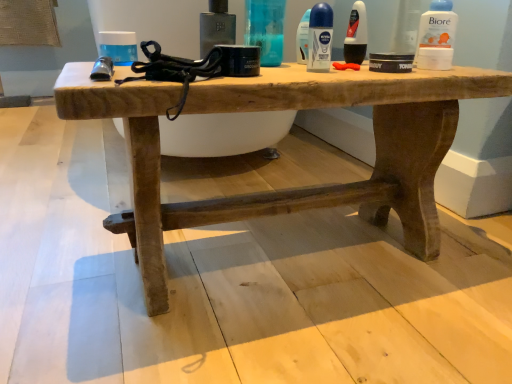
Question: From the image's perspective, is white plastic biore at upper right, which is counted as the second mouthwash, starting from the front, beneath matte black deodorant at center, the third toiletry viewed from the left?

Choices:
 (A) yes
 (B) no

Answer: (B)

Question: Is white plastic biore at upper right, which appears as the 3th mouthwash when viewed from the left, facing away from matte black deodorant at center, placed as the first toiletry when sorted from right to left?

Choices:
 (A) yes
 (B) no

Answer: (B)

Question: Considering the relative positions of white plastic biore at upper right, which appears as the 3th mouthwash when viewed from the left, and matte black deodorant at center, placed as the first toiletry when sorted from right to left, in the image provided, is white plastic biore at upper right, which appears as the 3th mouthwash when viewed from the left, behind matte black deodorant at center, placed as the first toiletry when sorted from right to left,?

Choices:
 (A) yes
 (B) no

Answer: (B)

Question: From a real-world perspective, is white plastic biore at upper right, which is the 2th mouthwash in back-to-front order, positioned over matte black deodorant at center, the third toiletry viewed from the left, based on gravity?

Choices:
 (A) no
 (B) yes

Answer: (B)

Question: Is matte black deodorant at center, placed as the first toiletry when sorted from right to left, located within white plastic biore at upper right, which is counted as the second mouthwash, starting from the front?

Choices:
 (A) yes
 (B) no

Answer: (B)

Question: Visually, is metallic black toiletry at upper center, the 3th toiletry in the right-to-left sequence, positioned to the left or to the right of white plastic biore at upper right, which appears as the 3th mouthwash when viewed from the left?

Choices:
 (A) left
 (B) right

Answer: (A)

Question: Is metallic black toiletry at upper center, which is counted as the first toiletry, starting from the left, inside the boundaries of white plastic biore at upper right, which is counted as the second mouthwash, starting from the front, or outside?

Choices:
 (A) inside
 (B) outside

Answer: (B)

Question: In terms of width, does metallic black toiletry at upper center, which is counted as the first toiletry, starting from the left, look wider or thinner when compared to white plastic biore at upper right, which appears as the 3th mouthwash when viewed from the left?

Choices:
 (A) wide
 (B) thin

Answer: (A)

Question: In terms of height, does metallic black toiletry at upper center, which is counted as the first toiletry, starting from the left, look taller or shorter compared to white plastic biore at upper right, which is the 2th mouthwash in back-to-front order?

Choices:
 (A) short
 (B) tall

Answer: (A)

Question: Considering the positions of translucent plastic bottle at upper center, which is the second toiletry from left to right, and blue matte deodorant at upper center, arranged as the first mouthwash when viewed from the back, in the image, is translucent plastic bottle at upper center, which is the second toiletry from left to right, taller or shorter than blue matte deodorant at upper center, arranged as the first mouthwash when viewed from the back,?

Choices:
 (A) tall
 (B) short

Answer: (A)

Question: Is point (270, 24) closer or farther from the camera than point (306, 18)?

Choices:
 (A) farther
 (B) closer

Answer: (B)

Question: From a real-world perspective, relative to blue matte deodorant at upper center, which is the 3th mouthwash from front to back, is translucent plastic bottle at upper center, the second toiletry viewed from the right, vertically above or below?

Choices:
 (A) above
 (B) below

Answer: (A)

Question: Which is correct: translucent plastic bottle at upper center, which is the second toiletry from left to right, is inside blue matte deodorant at upper center, arranged as the first mouthwash when viewed from the back, or outside of it?

Choices:
 (A) outside
 (B) inside

Answer: (A)

Question: Considering the relative positions of rustic wood table at center and matte black deodorant at center, placed as the first toiletry when sorted from right to left, in the image provided, is rustic wood table at center to the left or to the right of matte black deodorant at center, placed as the first toiletry when sorted from right to left,?

Choices:
 (A) left
 (B) right

Answer: (A)

Question: From a real-world perspective, relative to matte black deodorant at center, the third toiletry viewed from the left, is rustic wood table at center vertically above or below?

Choices:
 (A) above
 (B) below

Answer: (B)